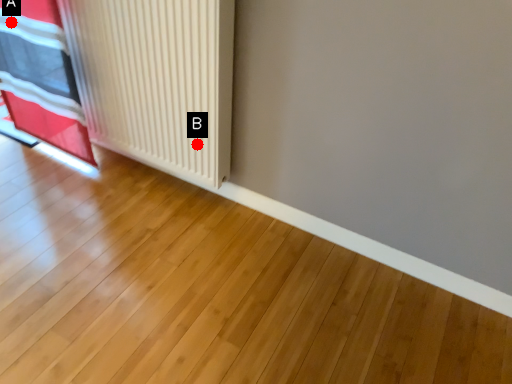
Question: Two points are circled on the image, labeled by A and B beside each circle. Which of the following is the farthest from the observer?

Choices:
 (A) A is further
 (B) B is further

Answer: (A)